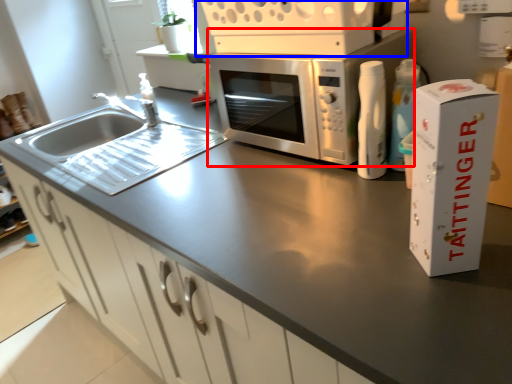
Question: Which point is closer to the camera, microwave oven (highlighted by a red box) or appliance (highlighted by a blue box)?

Choices:
 (A) microwave oven
 (B) appliance

Answer: (B)